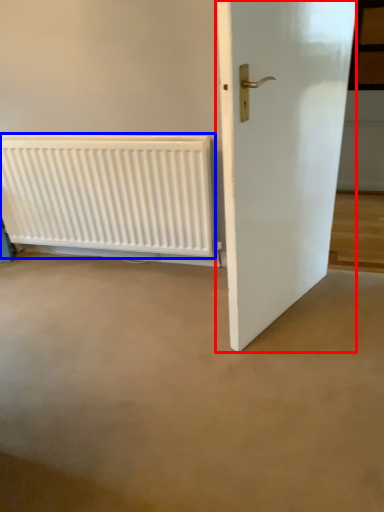
Question: Which point is further to the camera, door (highlighted by a red box) or radiator (highlighted by a blue box)?

Choices:
 (A) door
 (B) radiator

Answer: (B)